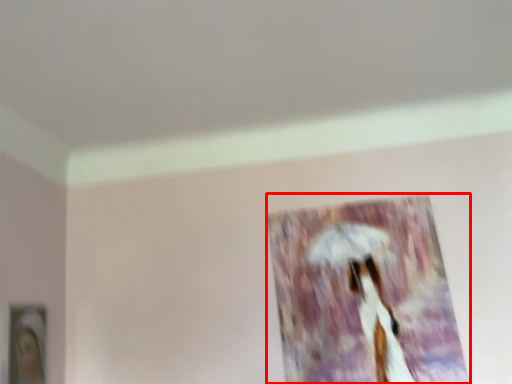
Question: From the image's perspective, where is picture frame (annotated by the red box) located in relation to picture frame in the image?

Choices:
 (A) below
 (B) above

Answer: (B)